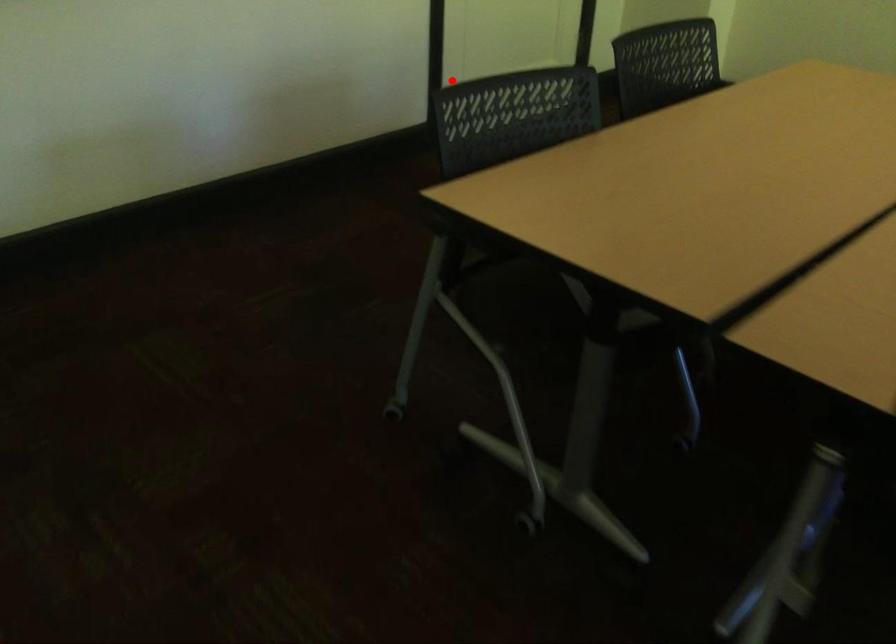
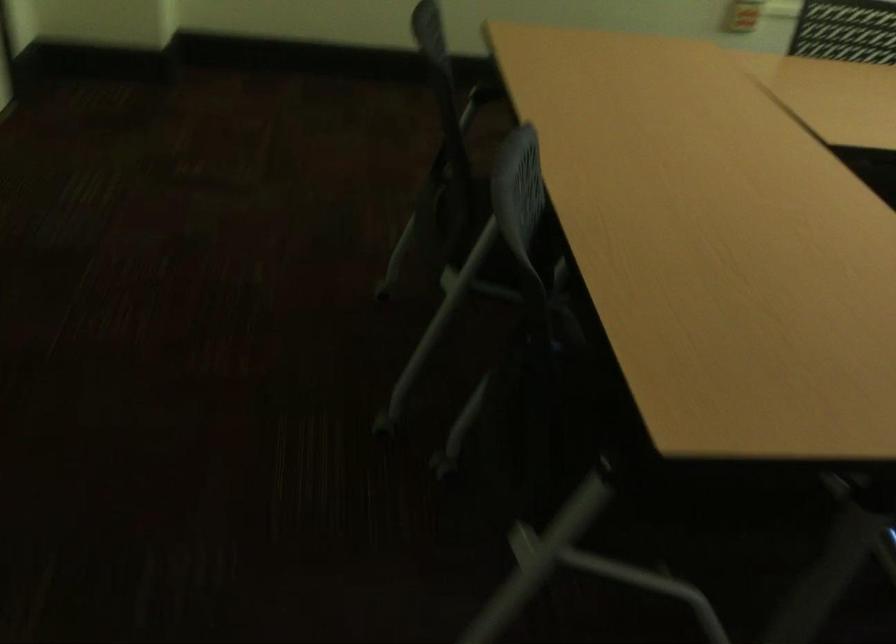
Where in the second image is the point corresponding to the highlighted location from the first image?

(501, 214)